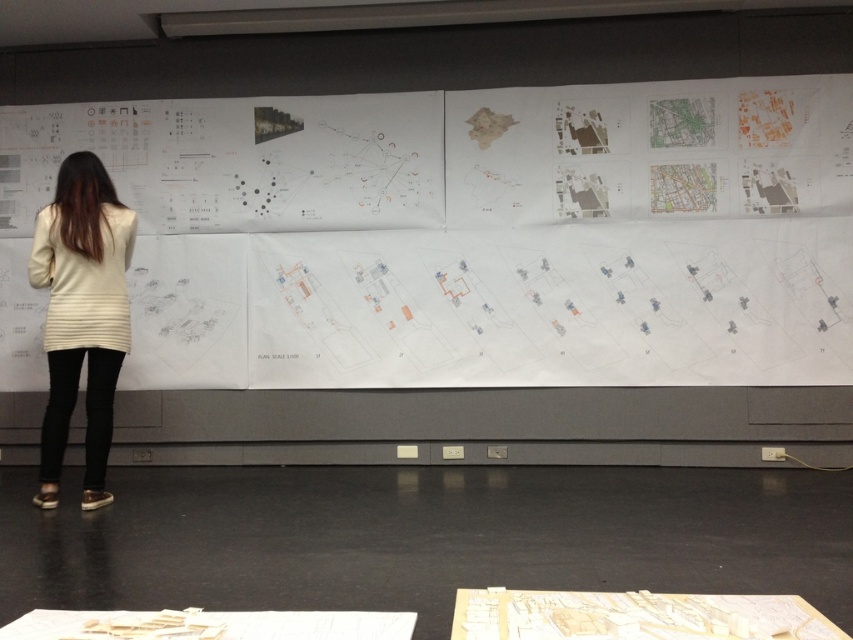
Does white paper at upper center have a larger size compared to creamy beige sweater at left?

Indeed, white paper at upper center has a larger size compared to creamy beige sweater at left.

Who is positioned more to the left, white paper at upper center or creamy beige sweater at left?

creamy beige sweater at left is more to the left.

Which is in front, point (136, 298) or point (113, 298)?

Point (113, 298) is in front.

You are a GUI agent. You are given a task and a screenshot of the screen. Output one action in this format:
    pyautogui.click(x=<x>, y=<y>)
    Task: Click on the white paper at upper center
    The image size is (853, 640).
    Given the screenshot: What is the action you would take?
    pyautogui.click(x=463, y=236)